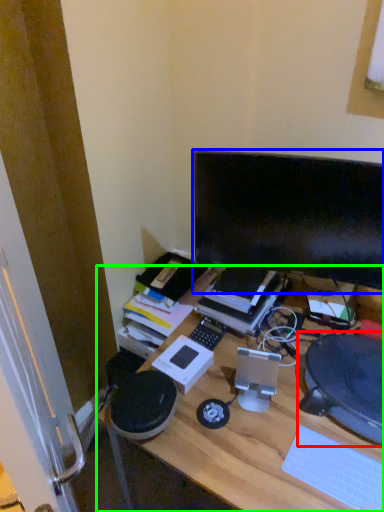
Question: Which object is the closest to the computer chair (highlighted by a red box)? Choose among these: computer monitor (highlighted by a blue box) or desk (highlighted by a green box).

Choices:
 (A) computer monitor
 (B) desk

Answer: (B)